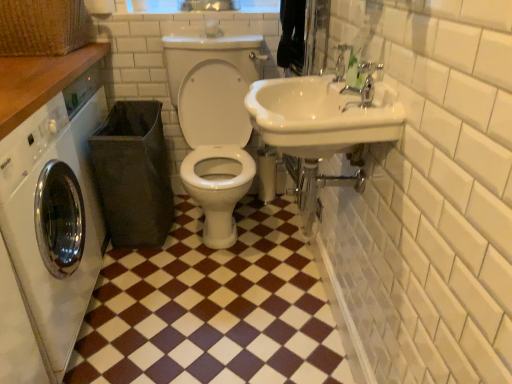
Find the location of `free point below white glossy sink at upper right (from a real-world perspective)`. free point below white glossy sink at upper right (from a real-world perspective) is located at coordinates (296, 335).